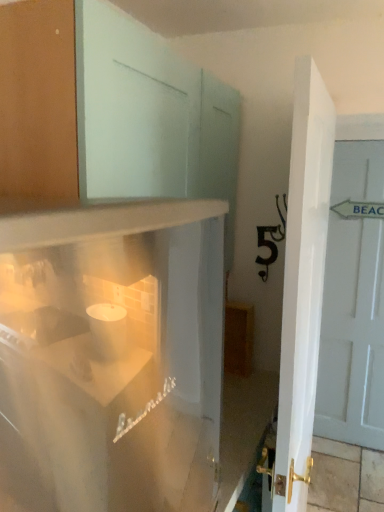
Question: Considering the relative positions of white glossy door at center, the second door positioned from the back, and white painted wood door at right, the 2th door from the left, in the image provided, is white glossy door at center, the second door positioned from the back, to the left of white painted wood door at right, the 2th door from the left, from the viewer's perspective?

Choices:
 (A) no
 (B) yes

Answer: (B)

Question: Would you consider white glossy door at center, which appears as the 1th door when viewed from the front, to be distant from white painted wood door at right, arranged as the 2th door when viewed from the front?

Choices:
 (A) yes
 (B) no

Answer: (A)

Question: Could you tell me if white glossy door at center, which appears as the second door when viewed from the right, is facing white painted wood door at right, the 2th door from the left?

Choices:
 (A) no
 (B) yes

Answer: (A)

Question: Is white glossy door at center, the second door positioned from the back, next to white painted wood door at right, which is counted as the 1th door, starting from the right?

Choices:
 (A) yes
 (B) no

Answer: (B)

Question: From the image's perspective, is white glossy door at center, which appears as the 1th door when viewed from the front, above white painted wood door at right, the first door positioned from the back?

Choices:
 (A) no
 (B) yes

Answer: (A)

Question: Is white glossy door at center, which appears as the second door when viewed from the right, smaller than white painted wood door at right, the 2th door from the left?

Choices:
 (A) no
 (B) yes

Answer: (A)

Question: Does white glossy door at center, which appears as the second door when viewed from the right, have a smaller size compared to white glossy refrigerator at lower left?

Choices:
 (A) no
 (B) yes

Answer: (B)

Question: Can white glossy refrigerator at lower left be found inside white glossy door at center, which appears as the 1th door when viewed from the front?

Choices:
 (A) yes
 (B) no

Answer: (B)

Question: Is white glossy door at center, positioned as the first door in left-to-right order, at the left side of white glossy refrigerator at lower left?

Choices:
 (A) no
 (B) yes

Answer: (A)

Question: Can you confirm if white glossy door at center, the second door positioned from the back, is bigger than white glossy refrigerator at lower left?

Choices:
 (A) no
 (B) yes

Answer: (A)

Question: Is white glossy door at center, which appears as the second door when viewed from the right, completely or partially outside of white glossy refrigerator at lower left?

Choices:
 (A) no
 (B) yes

Answer: (B)

Question: From a real-world perspective, is white glossy door at center, the second door positioned from the back, located higher than white glossy refrigerator at lower left?

Choices:
 (A) yes
 (B) no

Answer: (B)

Question: From a real-world perspective, is white glossy refrigerator at lower left below white painted wood door at right, which is counted as the 1th door, starting from the right?

Choices:
 (A) no
 (B) yes

Answer: (A)